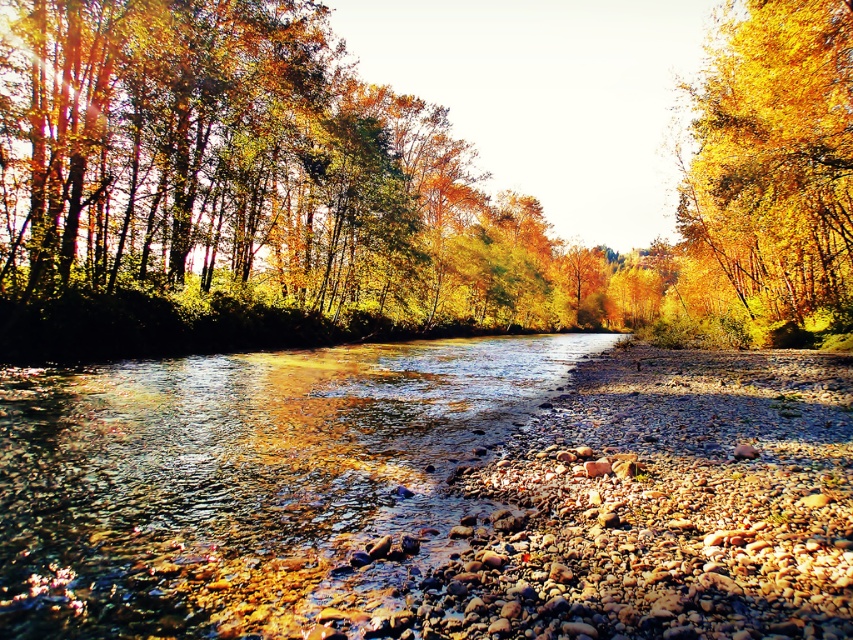
You are standing at the point with coordinates point [775,97] and want to walk to the point with coordinates point [310,458]. Which direction should you move to reach your destination?

You should move forward because point [310,458] is in front of point [775,97].

You are standing at the edge of the river and want to cross to the other side. The golden textured tree at center and the clear water at center are in your path. Which object should you avoid stepping on to ensure a stable footing?

You should avoid stepping on the clear water at center because the golden textured tree at center is larger in size and provides a more stable footing.

You are a kayaker planning to paddle through the center of the river. You notice the golden textured tree at center and the clear water at center. Which object are you directly above when you are in the middle of the river?

You are directly above the clear water at center when in the middle of the river, as the golden textured tree at center is positioned over it, meaning the tree is above the water.